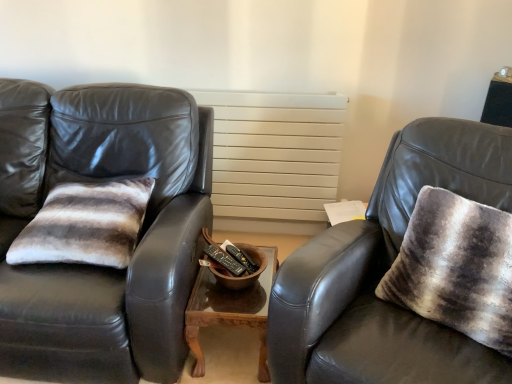
Image resolution: width=512 pixels, height=384 pixels. Describe the element at coordinates (456, 267) in the screenshot. I see `textured gray throw pillow at right` at that location.

The width and height of the screenshot is (512, 384). I want to click on matte black leather couch at left, so click(138, 237).

Image resolution: width=512 pixels, height=384 pixels. What do you see at coordinates (274, 153) in the screenshot? I see `white matte radiator at center` at bounding box center [274, 153].

What do you see at coordinates (231, 307) in the screenshot? The height and width of the screenshot is (384, 512). I see `wooden table at center` at bounding box center [231, 307].

The image size is (512, 384). Find the location of `textured gray throw pillow at right`. textured gray throw pillow at right is located at coordinates (456, 267).

Choose the correct answer: Is matte black leather couch at left inside matte black leather chair at right or outside it?

matte black leather couch at left lies outside matte black leather chair at right.

From the image's perspective, relative to matte black leather chair at right, is matte black leather couch at left above or below?

Clearly, from the image's perspective, matte black leather couch at left is above matte black leather chair at right.

In the image, is matte black leather couch at left positioned in front of or behind matte black leather chair at right?

In the image, matte black leather couch at left appears behind matte black leather chair at right.

From the image's perspective, does matte black leather chair at right appear higher than matte black leather couch at left?

No, from the image's perspective, matte black leather chair at right is not on top of matte black leather couch at left.

Is matte black leather couch at left surrounded by matte black leather chair at right?

No, matte black leather couch at left is located outside of matte black leather chair at right.

Does matte black leather chair at right appear on the left side of matte black leather couch at left?

No.

Who is more distant, matte black leather chair at right or matte black leather couch at left?

matte black leather couch at left is more distant.

From the image's perspective, is textured gray throw pillow at right over striped fur pillow at left?

No.

You are a GUI agent. You are given a task and a screenshot of the screen. Output one action in this format:
    pyautogui.click(x=<x>, y=<y>)
    Task: Click on the throw pillow that is below the striped fur pillow at left (from the image's perspective)
    
    Given the screenshot: What is the action you would take?
    pyautogui.click(x=456, y=267)

Is textured gray throw pillow at right to the right of striped fur pillow at left from the viewer's perspective?

Indeed, textured gray throw pillow at right is positioned on the right side of striped fur pillow at left.

Is striped fur pillow at left inside matte black leather chair at right?

No, striped fur pillow at left is located outside of matte black leather chair at right.

In the scene shown: Can you confirm if matte black leather chair at right is positioned to the left of striped fur pillow at left?

No, matte black leather chair at right is not to the left of striped fur pillow at left.

In the scene shown: Is matte black leather chair at right placed right next to striped fur pillow at left?

No, matte black leather chair at right is not beside striped fur pillow at left.

Between matte black leather chair at right and striped fur pillow at left, which one has larger size?

With larger size is matte black leather chair at right.

Is striped fur pillow at left further to camera compared to textured gray throw pillow at right?

Yes, striped fur pillow at left is further from the viewer.

From the image's perspective, is striped fur pillow at left above or below textured gray throw pillow at right?

Based on their image positions, striped fur pillow at left is located above textured gray throw pillow at right.

Is point (49, 222) positioned after point (420, 286)?

Yes, point (49, 222) is behind point (420, 286).

Would you say striped fur pillow at left is a long distance from textured gray throw pillow at right?

striped fur pillow at left is positioned a significant distance from textured gray throw pillow at right.

From the image's perspective, which is above, white matte radiator at center or wooden table at center?

From the image's view, white matte radiator at center is above.

How much distance is there between white matte radiator at center and wooden table at center?

30.92 inches.

Between white matte radiator at center and wooden table at center, which one appears on the left side from the viewer's perspective?

Positioned to the left is wooden table at center.

Is matte black leather couch at left looking in the opposite direction of white matte radiator at center?

Yes.

Would you say matte black leather couch at left is inside or outside white matte radiator at center?

matte black leather couch at left cannot be found inside white matte radiator at center.

Considering the positions of point (117, 313) and point (222, 198), is point (117, 313) closer or farther from the camera than point (222, 198)?

Point (117, 313).

You are a GUI agent. You are given a task and a screenshot of the screen. Output one action in this format:
    pyautogui.click(x=<x>, y=<y>)
    Task: Click on the chair located below the matte black leather couch at left (from the image's perspective)
    
    Given the screenshot: What is the action you would take?
    pyautogui.click(x=385, y=271)

The width and height of the screenshot is (512, 384). I want to click on studio couch lying on the left of matte black leather chair at right, so click(x=138, y=237).

Based on their spatial positions, is textured gray throw pillow at right or matte black leather chair at right closer to wooden table at center?

Among the two, matte black leather chair at right is located nearer to wooden table at center.

Considering their positions, is textured gray throw pillow at right positioned closer to white matte radiator at center than striped fur pillow at left?

Based on the image, striped fur pillow at left appears to be nearer to white matte radiator at center.

Which object lies further to the anchor point wooden table at center, matte black leather couch at left or matte black leather chair at right?

matte black leather chair at right is further to wooden table at center.

Considering their positions, is white matte radiator at center positioned closer to wooden table at center than striped fur pillow at left?

Based on the image, striped fur pillow at left appears to be nearer to wooden table at center.

Based on their spatial positions, is wooden table at center or matte black leather couch at left further from matte black leather chair at right?

matte black leather couch at left is further to matte black leather chair at right.

When comparing their distances from matte black leather couch at left, does textured gray throw pillow at right or matte black leather chair at right seem closer?

The object closer to matte black leather couch at left is matte black leather chair at right.

Based on their spatial positions, is striped fur pillow at left or matte black leather chair at right further from white matte radiator at center?

Based on the image, matte black leather chair at right appears to be further to white matte radiator at center.

Based on the photo, estimate the real-world distances between objects in this image. Which object is closer to white matte radiator at center, matte black leather couch at left or striped fur pillow at left?

Result: Based on the image, matte black leather couch at left appears to be nearer to white matte radiator at center.

Locate an element on the screen. The image size is (512, 384). pillow located between matte black leather couch at left and matte black leather chair at right in the left-right direction is located at coordinates (86, 224).

I want to click on table located between matte black leather couch at left and white matte radiator at center in the depth direction, so click(x=231, y=307).

This screenshot has height=384, width=512. Identify the location of pillow situated between matte black leather couch at left and wooden table at center from left to right. (86, 224).

Where is `table located between textured gray throw pillow at right and white matte radiator at center in the depth direction`? This screenshot has height=384, width=512. table located between textured gray throw pillow at right and white matte radiator at center in the depth direction is located at coordinates (231, 307).